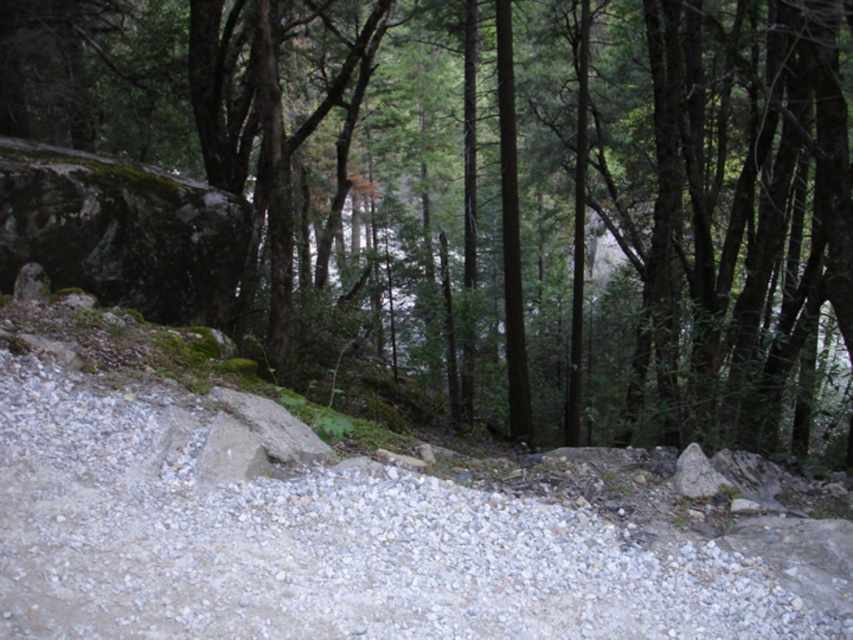
Between green leafy tree at center and gray gravel path at center, which one appears on the left side from the viewer's perspective?

Positioned to the left is gray gravel path at center.

Image resolution: width=853 pixels, height=640 pixels. Describe the element at coordinates (457, 192) in the screenshot. I see `green leafy tree at center` at that location.

Where is `green leafy tree at center`? green leafy tree at center is located at coordinates (457, 192).